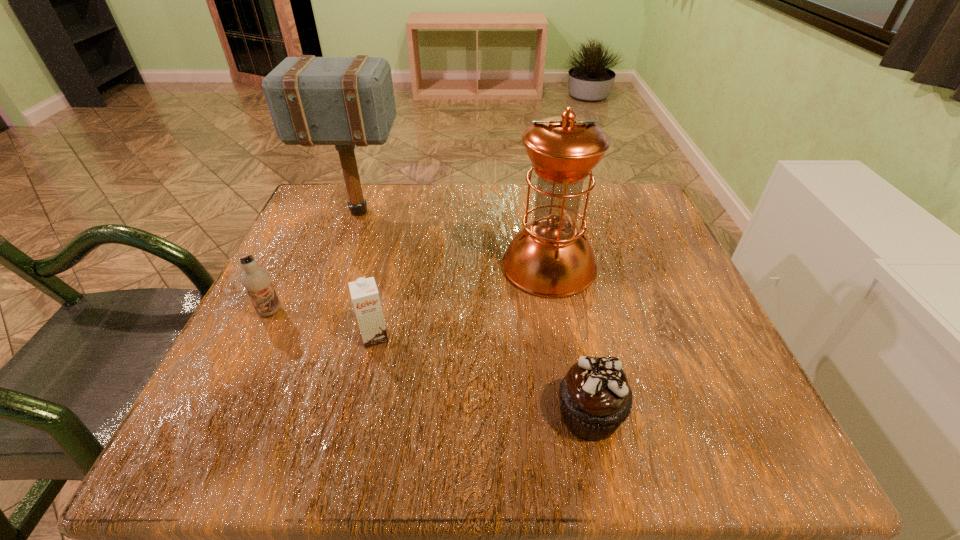
Where is `vacant region that satisfies the following two spatial constraints: 1. on the striking surface of the cupcake; 2. on the left side of the farthest object`? The height and width of the screenshot is (540, 960). vacant region that satisfies the following two spatial constraints: 1. on the striking surface of the cupcake; 2. on the left side of the farthest object is located at coordinates (283, 415).

Identify the location of vacant position in the image that satisfies the following two spatial constraints: 1. on the striking surface of the farthest object; 2. on the right side of the nearest object. [283, 415].

I want to click on vacant area that satisfies the following two spatial constraints: 1. on the front side of the oil lamp; 2. on the left side of the shortest object, so click(575, 415).

Find the location of a particular element. The height and width of the screenshot is (540, 960). vacant position in the image that satisfies the following two spatial constraints: 1. on the striking surface of the second farthest object; 2. on the right side of the farthest object is located at coordinates (338, 266).